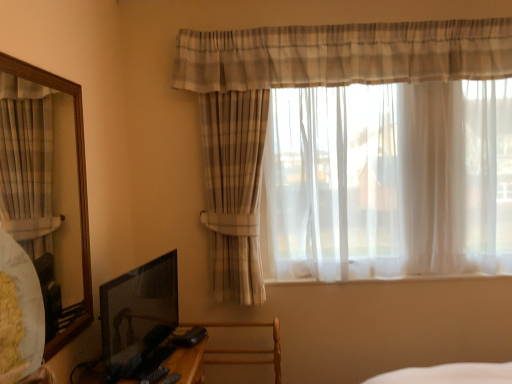
Question: Is point (458, 74) positioned closer to the camera than point (276, 324)?

Choices:
 (A) farther
 (B) closer

Answer: (B)

Question: From their relative heights in the image, would you say plaid sheer curtain at upper center is taller or shorter than wooden swivel chair at lower center?

Choices:
 (A) tall
 (B) short

Answer: (A)

Question: Estimate the real-world distances between objects in this image. Which object is farther from the wooden mirror at left?

Choices:
 (A) plaid sheer curtain at upper center
 (B) matte black tv at lower left
 (C) wooden swivel chair at lower center

Answer: (A)

Question: Estimate the real-world distances between objects in this image. Which object is farther from the plaid sheer curtain at upper center?

Choices:
 (A) wooden swivel chair at lower center
 (B) wooden mirror at left
 (C) matte black tv at lower left

Answer: (B)